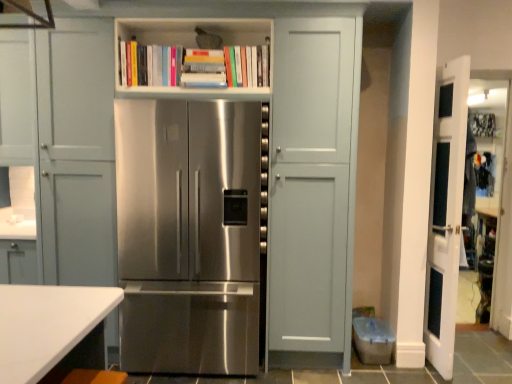
Question: Is stainless steel refrigerator at center positioned before white glossy door at right?

Choices:
 (A) yes
 (B) no

Answer: (A)

Question: Is white glossy door at right a part of stainless steel refrigerator at center?

Choices:
 (A) yes
 (B) no

Answer: (B)

Question: Considering the relative positions of stainless steel refrigerator at center and white glossy door at right in the image provided, is stainless steel refrigerator at center to the left of white glossy door at right from the viewer's perspective?

Choices:
 (A) yes
 (B) no

Answer: (A)

Question: From a real-world perspective, is stainless steel refrigerator at center under white glossy door at right?

Choices:
 (A) yes
 (B) no

Answer: (A)

Question: Is stainless steel refrigerator at center positioned beyond the bounds of white glossy door at right?

Choices:
 (A) no
 (B) yes

Answer: (B)

Question: Does stainless steel refrigerator at center have a smaller size compared to white glossy door at right?

Choices:
 (A) no
 (B) yes

Answer: (A)

Question: From the image's perspective, is white glossy door at right on top of stainless steel refrigerator at center?

Choices:
 (A) no
 (B) yes

Answer: (B)

Question: Does white glossy door at right touch stainless steel refrigerator at center?

Choices:
 (A) yes
 (B) no

Answer: (B)

Question: Is white glossy door at right positioned far away from stainless steel refrigerator at center?

Choices:
 (A) no
 (B) yes

Answer: (B)

Question: Considering the relative sizes of white glossy door at right and stainless steel refrigerator at center in the image provided, is white glossy door at right bigger than stainless steel refrigerator at center?

Choices:
 (A) yes
 (B) no

Answer: (B)

Question: Does white glossy door at right have a greater width compared to stainless steel refrigerator at center?

Choices:
 (A) yes
 (B) no

Answer: (B)

Question: From a real-world perspective, is white glossy door at right on stainless steel refrigerator at center?

Choices:
 (A) no
 (B) yes

Answer: (B)

Question: Is white matte bookshelf at upper center closer to the viewer compared to stainless steel refrigerator at center?

Choices:
 (A) yes
 (B) no

Answer: (B)